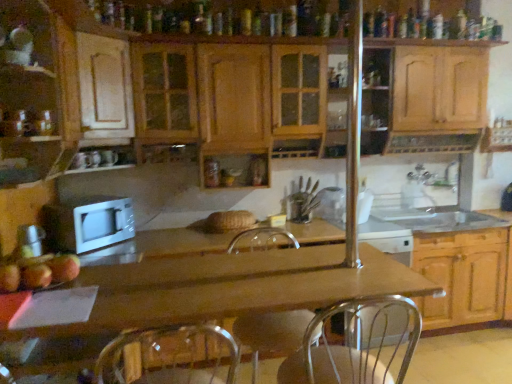
Image resolution: width=512 pixels, height=384 pixels. Describe the element at coordinates (438, 219) in the screenshot. I see `white glossy sink at right` at that location.

In order to click on wooden cabinets at center, acting as the second cabinetry starting from the right in this screenshot , I will do `click(161, 84)`.

What do you see at coordinates (336, 288) in the screenshot? The image size is (512, 384). I see `wooden at center` at bounding box center [336, 288].

Describe the element at coordinates (330, 203) in the screenshot. I see `clear glass jar at center` at that location.

This screenshot has width=512, height=384. Identify the location of white matte microwave at center. (88, 223).

Image resolution: width=512 pixels, height=384 pixels. What are the coordinates of `red matte apple at lower left` in the screenshot? It's located at (38, 272).

Image resolution: width=512 pixels, height=384 pixels. I want to click on white glossy sink at right, so [x=438, y=219].

Is wooden cabinets at center, acting as the second cabinetry starting from the left, positioned with its back to white glossy sink at right?

That's not correct — wooden cabinets at center, acting as the second cabinetry starting from the left, is not looking away from white glossy sink at right.

Would you say white glossy sink at right is part of wooden cabinets at center, acting as the second cabinetry starting from the left,'s contents?

No, white glossy sink at right is not a part of wooden cabinets at center, acting as the second cabinetry starting from the left.

From a real-world perspective, who is located higher, wooden cabinets at center, acting as the second cabinetry starting from the left, or white glossy sink at right?

wooden cabinets at center, acting as the second cabinetry starting from the left, from a real-world perspective.

Which object is more forward, silver metallic faucet at sink right, placed as the first faucet when sorted from left to right, or wooden at center?

wooden at center is more forward.

Considering the points (413, 189) and (289, 288), which point is behind, point (413, 189) or point (289, 288)?

The point (413, 189) is behind.

Between silver metallic faucet at sink right, placed as the first faucet when sorted from left to right, and wooden at center, which one has more height?

wooden at center.

How different are the orientations of silver metallic faucet at sink right, acting as the 2th faucet starting from the right, and wooden at center in degrees?

89.8 degrees separate the facing orientations of silver metallic faucet at sink right, acting as the 2th faucet starting from the right, and wooden at center.

Which point is more forward, (94,196) or (480,232)?

The point (94,196) is in front.

Can you confirm if white matte microwave at center is shorter than wooden cabinet at lower right, the third cabinetry positioned from the left?

Indeed, white matte microwave at center has a lesser height compared to wooden cabinet at lower right, the third cabinetry positioned from the left.

Does white matte microwave at center turn towards wooden cabinet at lower right, the third cabinetry positioned from the left?

No, white matte microwave at center is not turned towards wooden cabinet at lower right, the third cabinetry positioned from the left.

How different are the orientations of red matte apple at lower left and wooden at center in degrees?

There is a 0.794-degree angle between the facing directions of red matte apple at lower left and wooden at center.

Based on the photo, from the image's perspective, which one is positioned lower, red matte apple at lower left or wooden at center?

From the image's view, wooden at center is below.

From a real-world perspective, is red matte apple at lower left physically below wooden at center?

Actually, red matte apple at lower left is physically above wooden at center in the real world.

Image resolution: width=512 pixels, height=384 pixels. Identify the location of countertop on the right of red matte apple at lower left. (336, 288).

Does red matte apple at lower left have a greater height compared to silver metallic faucet at sink right, placed as the first faucet when sorted from left to right?

No, red matte apple at lower left is not taller than silver metallic faucet at sink right, placed as the first faucet when sorted from left to right.

Could you tell me if red matte apple at lower left is turned towards silver metallic faucet at sink right, acting as the 2th faucet starting from the right?

No.

From a real-world perspective, is red matte apple at lower left located beneath silver metallic faucet at sink right, placed as the first faucet when sorted from left to right?

Incorrect, from a real-world perspective, red matte apple at lower left is higher than silver metallic faucet at sink right, placed as the first faucet when sorted from left to right.

Is wooden cabinet at lower right, the third cabinetry positioned from the left, inside or outside of red matte apple at lower left?

wooden cabinet at lower right, the third cabinetry positioned from the left, is located beyond the bounds of red matte apple at lower left.

Which point is more forward, (505, 229) or (65, 275)?

The point (65, 275) is in front.

Is wooden cabinet at lower right, the third cabinetry positioned from the left, closer to camera compared to red matte apple at lower left?

No, it is not.

Measure the distance between wooden cabinet at lower right, which ranks as the first cabinetry in right-to-left order, and red matte apple at lower left.

wooden cabinet at lower right, which ranks as the first cabinetry in right-to-left order, and red matte apple at lower left are 8.66 feet apart from each other.

Does silver metallic faucet at upper right, positioned as the second faucet in left-to-right order, have a greater width compared to wooden at center?

In fact, silver metallic faucet at upper right, positioned as the second faucet in left-to-right order, might be narrower than wooden at center.

Is silver metallic faucet at upper right, arranged as the first faucet when viewed from the right, not near wooden at center?

Yes, silver metallic faucet at upper right, arranged as the first faucet when viewed from the right, and wooden at center are quite far apart.

Looking at this image, is silver metallic faucet at upper right, arranged as the first faucet when viewed from the right, oriented away from wooden at center?

That's not correct — silver metallic faucet at upper right, arranged as the first faucet when viewed from the right, is not looking away from wooden at center.

Which is behind, point (453, 164) or point (505, 314)?

The point (453, 164) is farther.

You are a GUI agent. You are given a task and a screenshot of the screen. Output one action in this format:
    pyautogui.click(x=<x>, y=<y>)
    Task: Click on the sink below the wooden cabinets at center, acting as the second cabinetry starting from the right (from a real-world perspective)
    The width and height of the screenshot is (512, 384).
    Given the screenshot: What is the action you would take?
    pyautogui.click(x=438, y=219)

This screenshot has width=512, height=384. Find the location of `countertop on the left of silver metallic faucet at sink right, acting as the 2th faucet starting from the right`. countertop on the left of silver metallic faucet at sink right, acting as the 2th faucet starting from the right is located at coordinates (336, 288).

Estimate the real-world distances between objects in this image. Which object is further from metallic silver swivel chair at center, white matte microwave at center or wooden cabinet at lower right, the third cabinetry positioned from the left?

Based on the image, wooden cabinet at lower right, the third cabinetry positioned from the left, appears to be further to metallic silver swivel chair at center.

Looking at the image, which one is located closer to clear glass jar at center, red matte apple at lower left or matte wood cabinet at left, acting as the third cabinetry starting from the right?

matte wood cabinet at left, acting as the third cabinetry starting from the right, is positioned closer to the anchor clear glass jar at center.

Based on their spatial positions, is red matte apple at lower left or white glossy sink at right further from wooden cabinet at lower right, the third cabinetry positioned from the left?

red matte apple at lower left is further to wooden cabinet at lower right, the third cabinetry positioned from the left.

From the picture: Based on their spatial positions, is white matte microwave at center or red matte apple at lower left further from clear glass jar at center?

Based on the image, red matte apple at lower left appears to be further to clear glass jar at center.

When comparing their distances from clear glass jar at center, does silver metallic faucet at upper right, arranged as the first faucet when viewed from the right, or matte wood cabinet at left, the 1th cabinetry from the left, seem further?

matte wood cabinet at left, the 1th cabinetry from the left, is further to clear glass jar at center.

From the image, which object appears to be nearer to silver metallic faucet at upper right, arranged as the first faucet when viewed from the right, silver metallic faucet at sink right, acting as the 2th faucet starting from the right, or wooden cabinets at center, acting as the second cabinetry starting from the left?

The object closer to silver metallic faucet at upper right, arranged as the first faucet when viewed from the right, is silver metallic faucet at sink right, acting as the 2th faucet starting from the right.

Estimate the real-world distances between objects in this image. Which object is closer to clear glass jar at center, matte wood cabinet at left, acting as the third cabinetry starting from the right, or wooden cabinets at center, acting as the second cabinetry starting from the left?

Among the two, wooden cabinets at center, acting as the second cabinetry starting from the left, is located nearer to clear glass jar at center.

Based on their spatial positions, is wooden cabinets at center, acting as the second cabinetry starting from the right, or silver metallic faucet at sink right, placed as the first faucet when sorted from left to right, closer to wooden at center?

wooden cabinets at center, acting as the second cabinetry starting from the right.

This screenshot has width=512, height=384. In order to click on swivel chair between matte wood cabinet at left, acting as the third cabinetry starting from the right, and wooden at center vertically in this screenshot , I will do `click(271, 333)`.

Locate an element on the screen. The height and width of the screenshot is (384, 512). faucet between wooden cabinets at center, acting as the second cabinetry starting from the left, and silver metallic faucet at upper right, arranged as the first faucet when viewed from the right, along the z-axis is located at coordinates (416, 188).

Locate an element on the screen. apple between matte wood cabinet at left, the 1th cabinetry from the left, and wooden cabinet at lower right, the third cabinetry positioned from the left, in the horizontal direction is located at coordinates (38, 272).

Find the location of a particular element. faucet situated between white matte microwave at center and wooden cabinet at lower right, the third cabinetry positioned from the left, from left to right is located at coordinates (416, 188).